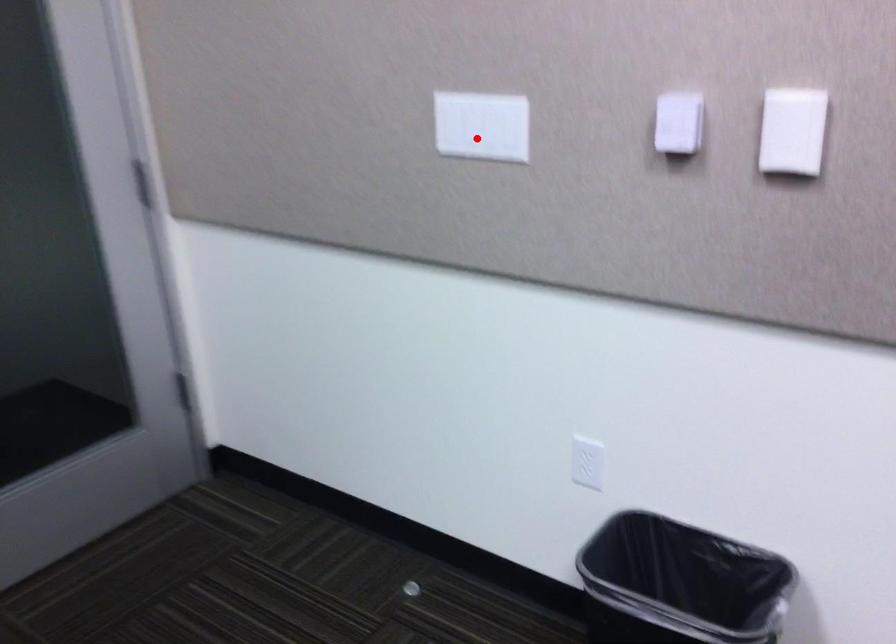
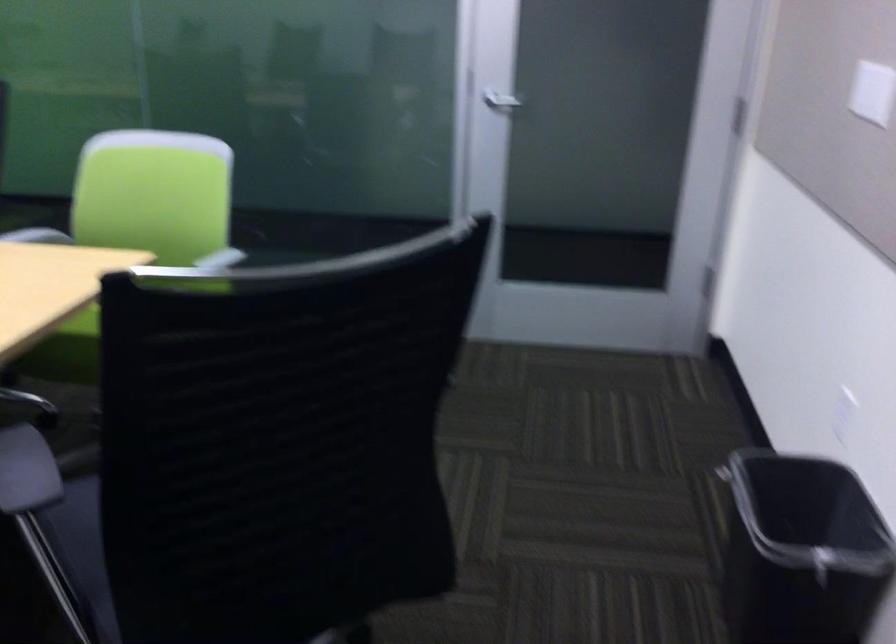
In the second image, find the point that corresponds to the highlighted location in the first image.

(872, 91)